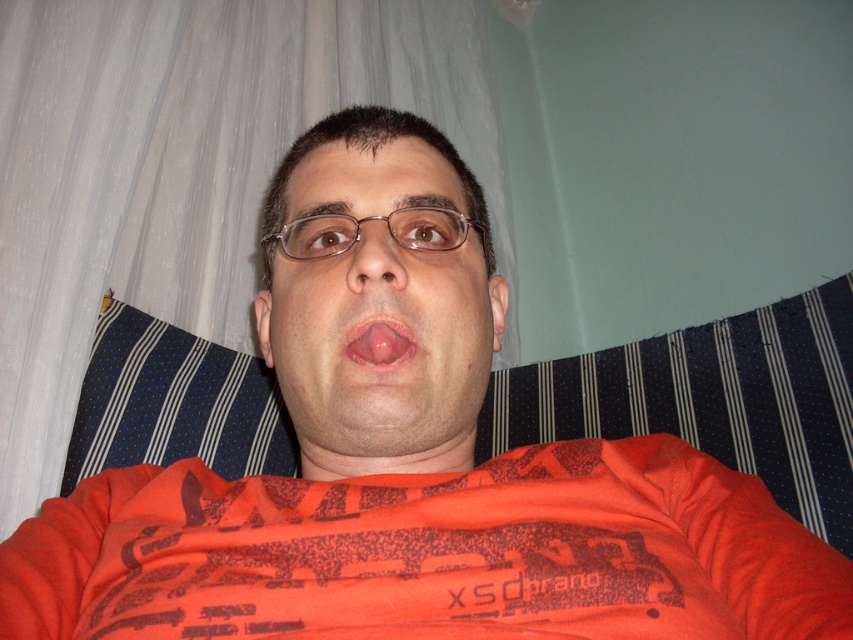
Question: Does matte orange face at center have a greater width compared to pink glossy tongue at center?

Choices:
 (A) yes
 (B) no

Answer: (A)

Question: Which object is positioned farthest from the matte orange face at center?

Choices:
 (A) matte brown nose at center
 (B) pink glossy tongue at center

Answer: (B)

Question: Which point appears closest to the camera in this image?

Choices:
 (A) (378, 260)
 (B) (434, 396)

Answer: (A)

Question: Does matte orange face at center have a larger size compared to pink glossy tongue at center?

Choices:
 (A) no
 (B) yes

Answer: (B)

Question: Estimate the real-world distances between objects in this image. Which object is closer to the matte brown nose at center?

Choices:
 (A) pink glossy tongue at center
 (B) matte orange face at center

Answer: (A)

Question: Can you confirm if matte orange face at center is smaller than pink glossy tongue at center?

Choices:
 (A) yes
 (B) no

Answer: (B)